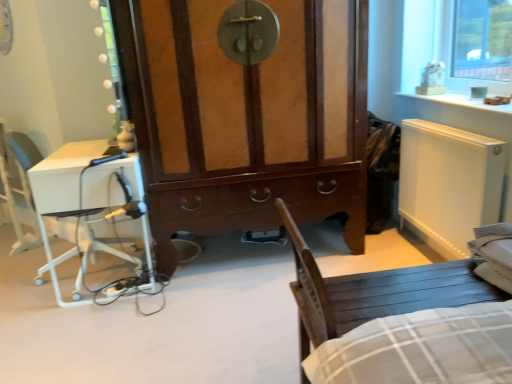
Question: From a real-world perspective, is wooden chair at lower right located beneath white plastic armchair at left?

Choices:
 (A) no
 (B) yes

Answer: (B)

Question: Is wooden chair at lower right smaller than white plastic armchair at left?

Choices:
 (A) yes
 (B) no

Answer: (B)

Question: Considering the relative sizes of wooden chair at lower right and white plastic armchair at left in the image provided, is wooden chair at lower right wider than white plastic armchair at left?

Choices:
 (A) yes
 (B) no

Answer: (A)

Question: Could you tell me if wooden chair at lower right is turned towards white plastic armchair at left?

Choices:
 (A) no
 (B) yes

Answer: (A)

Question: Considering the relative sizes of wooden chair at lower right and white plastic armchair at left in the image provided, is wooden chair at lower right shorter than white plastic armchair at left?

Choices:
 (A) no
 (B) yes

Answer: (B)

Question: From a real-world perspective, relative to white glossy desk at left, is brown wood cabinet at center vertically above or below?

Choices:
 (A) below
 (B) above

Answer: (B)

Question: Considering the positions of brown wood cabinet at center and white glossy desk at left in the image, is brown wood cabinet at center wider or thinner than white glossy desk at left?

Choices:
 (A) wide
 (B) thin

Answer: (A)

Question: From the image's perspective, is brown wood cabinet at center above or below white glossy desk at left?

Choices:
 (A) above
 (B) below

Answer: (A)

Question: Which is correct: brown wood cabinet at center is inside white glossy desk at left, or outside of it?

Choices:
 (A) inside
 (B) outside

Answer: (B)

Question: Is white matte radiator at right bigger or smaller than brown wood cabinet at center?

Choices:
 (A) small
 (B) big

Answer: (A)

Question: Relative to brown wood cabinet at center, is white matte radiator at right in front or behind?

Choices:
 (A) behind
 (B) front

Answer: (B)

Question: Is white matte radiator at right wider or thinner than brown wood cabinet at center?

Choices:
 (A) wide
 (B) thin

Answer: (B)

Question: From a real-world perspective, is white matte radiator at right positioned above or below brown wood cabinet at center?

Choices:
 (A) above
 (B) below

Answer: (B)

Question: Is white glossy desk at left wider or thinner than brown wood cabinet at center?

Choices:
 (A) wide
 (B) thin

Answer: (B)

Question: In the image, is white glossy desk at left positioned in front of or behind brown wood cabinet at center?

Choices:
 (A) front
 (B) behind

Answer: (B)